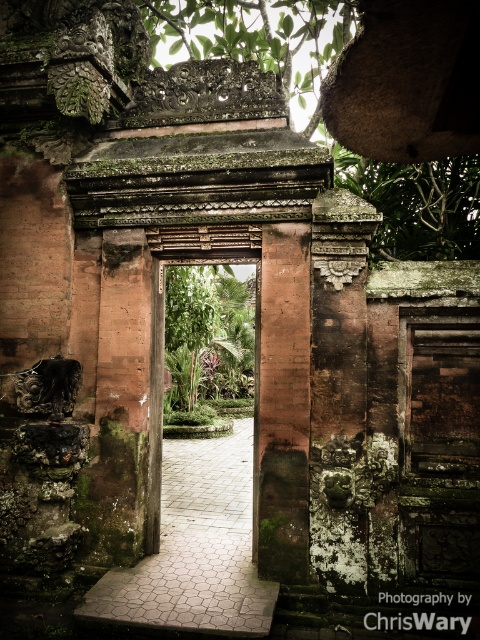
Is smooth stone path at center taller than brown stone pillar at center?

In fact, smooth stone path at center may be shorter than brown stone pillar at center.

Can you confirm if smooth stone path at center is positioned to the right of brown stone pillar at center?

Incorrect, smooth stone path at center is not on the right side of brown stone pillar at center.

The height and width of the screenshot is (640, 480). What do you see at coordinates (194, 550) in the screenshot? I see `smooth stone path at center` at bounding box center [194, 550].

This screenshot has height=640, width=480. Find the location of `smooth stone path at center`. smooth stone path at center is located at coordinates (194, 550).

Which is behind, point (299, 461) or point (166, 342)?

The point (166, 342) is more distant.

Can you confirm if brown stone pillar at center is shorter than green leafy plant at center?

No, brown stone pillar at center is not shorter than green leafy plant at center.

Who is more forward, (272, 296) or (183, 317)?

Point (272, 296) is more forward.

Locate an element on the screen. brown stone pillar at center is located at coordinates (282, 404).

Who is shorter, smooth stone path at center or green leafy plant at center?

With less height is smooth stone path at center.

Does smooth stone path at center appear under green leafy plant at center?

Yes, smooth stone path at center is below green leafy plant at center.

Is point (132, 627) farther from camera compared to point (191, 282)?

No, it is in front of (191, 282).

The height and width of the screenshot is (640, 480). Identify the location of smooth stone path at center. (194, 550).